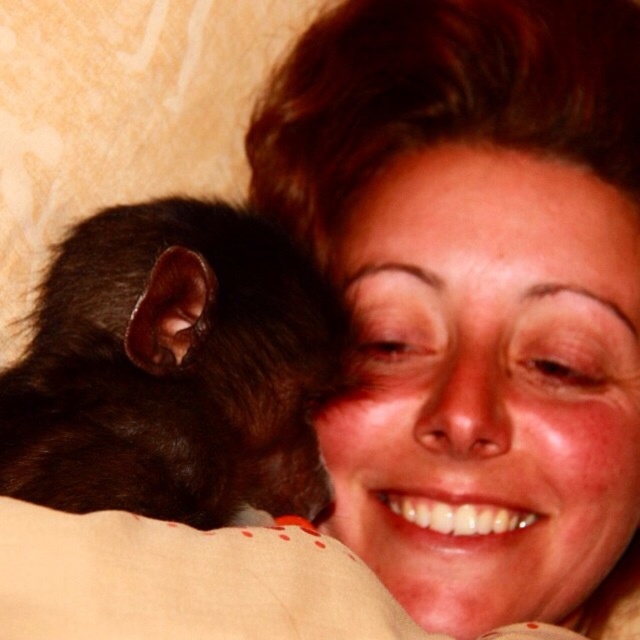
Question: Can you confirm if matte black fur at upper center is smaller than black furry mouse at left?

Choices:
 (A) no
 (B) yes

Answer: (A)

Question: Can you confirm if matte black fur at upper center is smaller than black furry mouse at left?

Choices:
 (A) no
 (B) yes

Answer: (A)

Question: Which point is closer to the camera taking this photo?

Choices:
 (A) (458, 305)
 (B) (248, 365)

Answer: (B)

Question: Can you confirm if matte black fur at upper center is positioned above black furry mouse at left?

Choices:
 (A) yes
 (B) no

Answer: (A)

Question: Which point is closer to the camera taking this photo?

Choices:
 (A) (346, 371)
 (B) (541, 236)

Answer: (A)